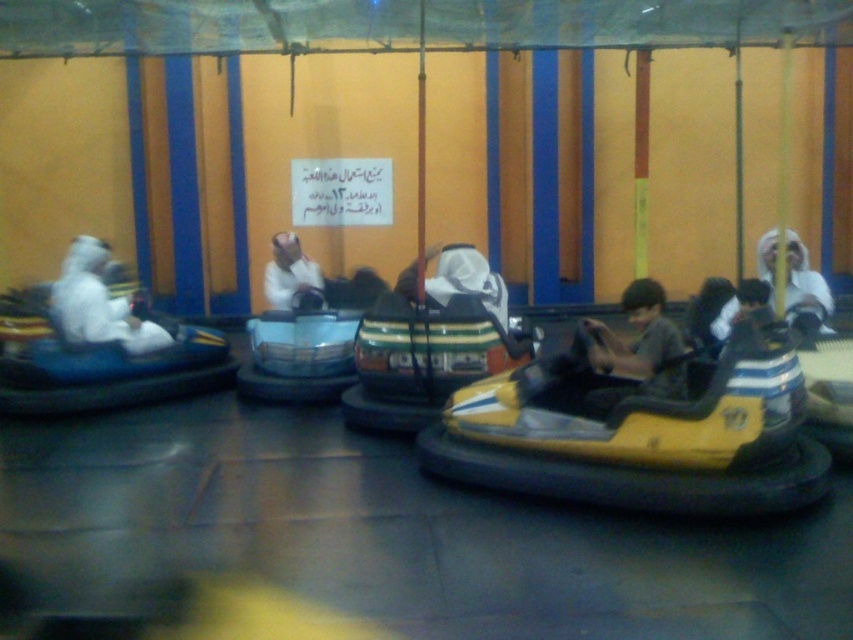
Question: Which point is closer to the camera?

Choices:
 (A) (610, 384)
 (B) (67, 326)
 (C) (271, 300)
 (D) (798, 316)

Answer: (A)

Question: Does yellow matte bumper car at center appear on the right side of matte yellow bumper car at center?

Choices:
 (A) yes
 (B) no

Answer: (B)

Question: Which point is closer to the camera?

Choices:
 (A) white matte headscarf at upper right
 (B) matte yellow bumper car at center
 (C) yellow matte bumper car at center
 (D) white matte headscarf at center

Answer: (C)

Question: Can you confirm if matte yellow bumper car at center is positioned to the left of white matte headscarf at center?

Choices:
 (A) yes
 (B) no

Answer: (B)

Question: Is white matte helmet at left below white matte headscarf at center?

Choices:
 (A) no
 (B) yes

Answer: (B)

Question: Which object is the farthest from the matte yellow bumper car at center?

Choices:
 (A) white matte helmet at left
 (B) white matte headscarf at center
 (C) white matte headscarf at upper right
 (D) yellow matte bumper car at center

Answer: (A)